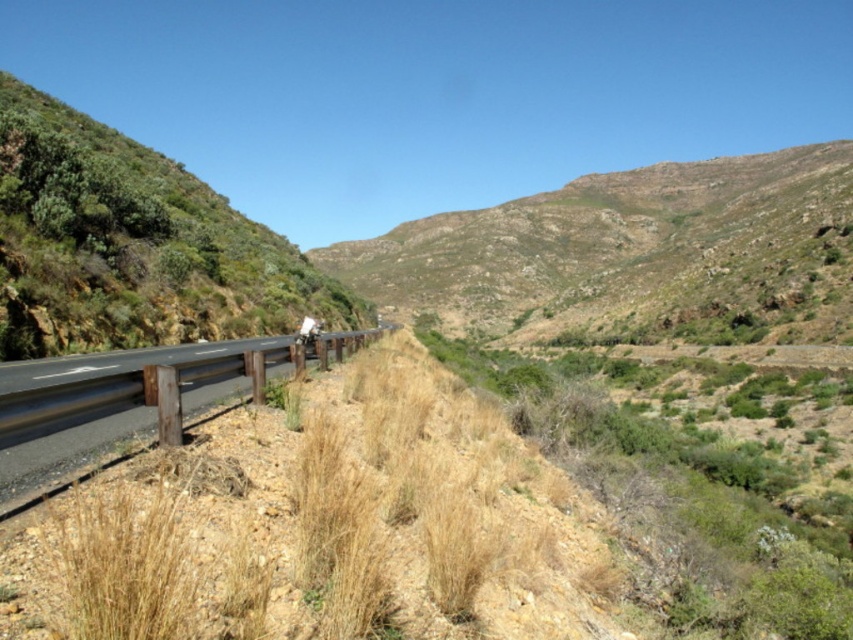
Question: Which object appears closest to the camera in this image?

Choices:
 (A) asphalt road at lower left
 (B) green grassy hillside at center

Answer: (A)

Question: Can you confirm if green grassy hillside at center is positioned to the right of asphalt road at lower left?

Choices:
 (A) no
 (B) yes

Answer: (B)

Question: Among these points, which one is farthest from the camera?

Choices:
 (A) (564, 253)
 (B) (115, 385)

Answer: (A)

Question: From the image, what is the correct spatial relationship of green grassy hillside at center in relation to asphalt road at lower left?

Choices:
 (A) left
 (B) right

Answer: (B)

Question: Is the position of green grassy hillside at center less distant than that of asphalt road at lower left?

Choices:
 (A) no
 (B) yes

Answer: (A)